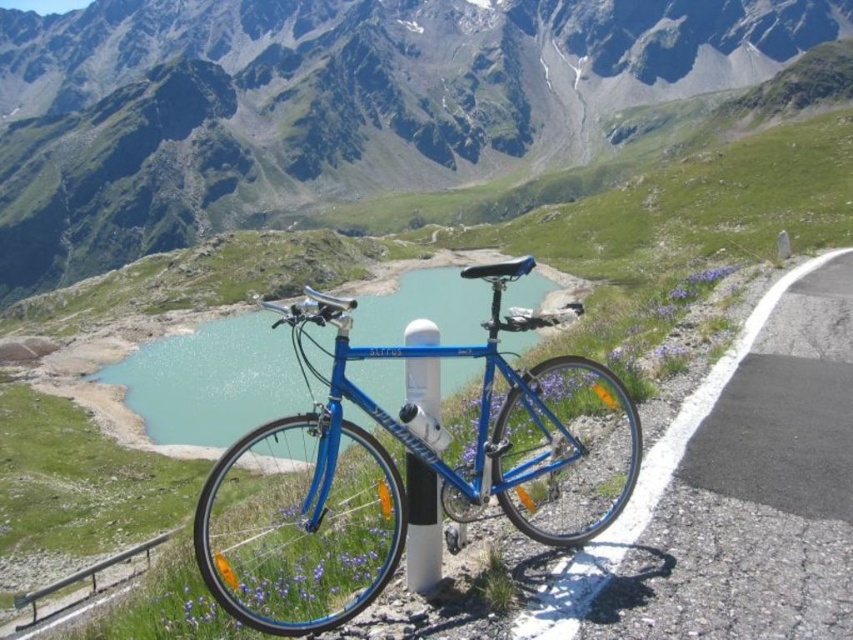
Question: Which of these objects is positioned closest to the wooden rail at lower left?

Choices:
 (A) blue metallic bicycle at center
 (B) white plastic pole at center

Answer: (A)

Question: Among these points, which one is farthest from the camera?

Choices:
 (A) (3, 276)
 (B) (432, 513)
 (C) (579, 611)

Answer: (A)

Question: Is blue glassy water at center thinner than wooden rail at lower left?

Choices:
 (A) no
 (B) yes

Answer: (A)

Question: Can you confirm if blue metallic bicycle at center is positioned to the left of asphalt road at right?

Choices:
 (A) no
 (B) yes

Answer: (B)

Question: Which of the following is the closest to the observer?

Choices:
 (A) (556, 632)
 (B) (248, 397)
 (C) (364, 540)

Answer: (A)

Question: Is the position of matte blue bicycle at center less distant than that of asphalt road at right?

Choices:
 (A) no
 (B) yes

Answer: (A)